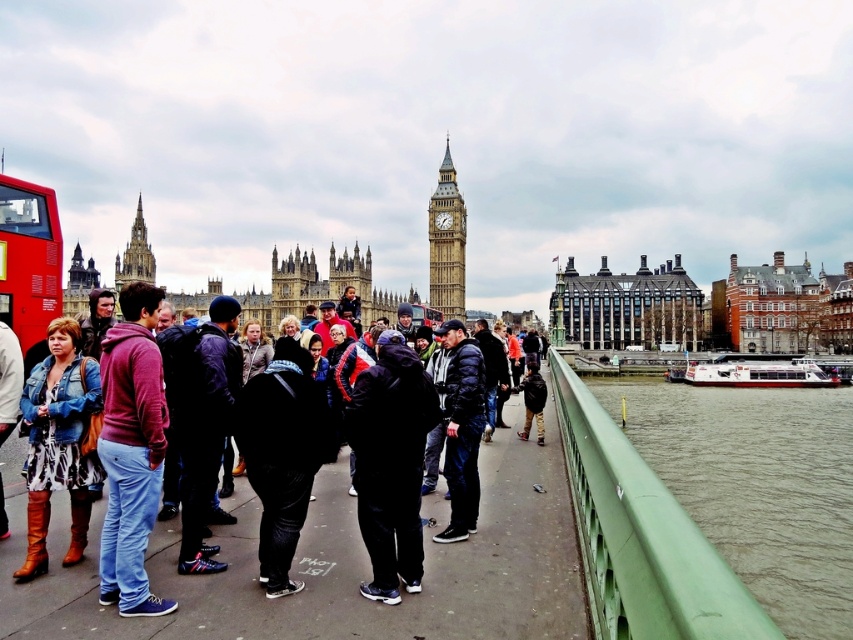
Question: Which point appears closest to the camera in this image?

Choices:
 (A) click(x=65, y=381)
 (B) click(x=782, y=486)
 (C) click(x=434, y=196)
 (D) click(x=13, y=184)

Answer: (A)

Question: Does red matte bus at left lie in front of stone clock tower at center?

Choices:
 (A) no
 (B) yes

Answer: (B)

Question: Does green rubber railing at lower right come in front of red matte bus at left?

Choices:
 (A) yes
 (B) no

Answer: (A)

Question: Among these points, which one is nearest to the camera?

Choices:
 (A) (115, 324)
 (B) (836, 388)
 (C) (33, 372)
 (D) (33, 266)

Answer: (C)

Question: Does green rubber railing at lower right come in front of stone clock tower at center?

Choices:
 (A) yes
 (B) no

Answer: (A)

Question: Which object appears closest to the camera in this image?

Choices:
 (A) maroon fleece jacket at center
 (B) leather boots at lower left
 (C) green rubber railing at lower right
 (D) stone spire at upper left

Answer: (A)